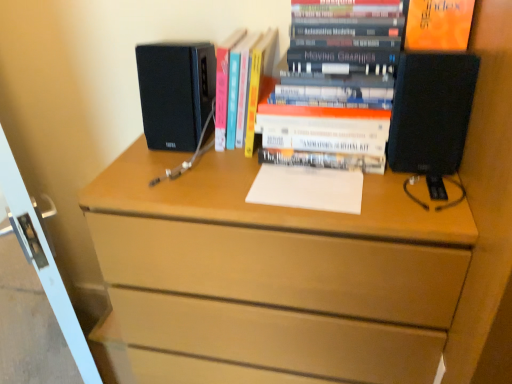
Where is `free space on the front side of hardcover books at center, which appears as the 2th book when viewed from the left`? free space on the front side of hardcover books at center, which appears as the 2th book when viewed from the left is located at coordinates (367, 201).